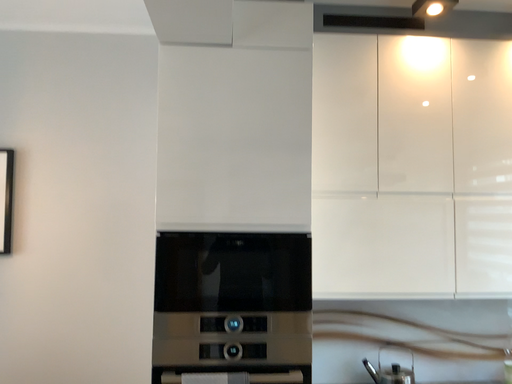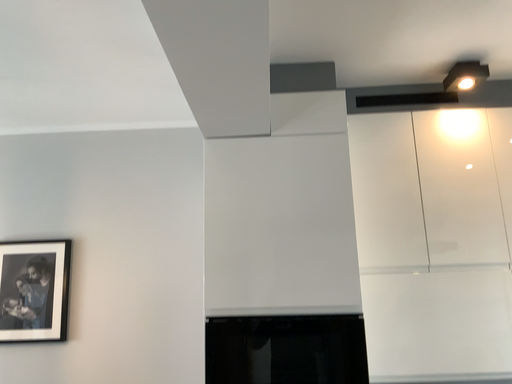
Question: Which way did the camera rotate in the video?

Choices:
 (A) rotated downward
 (B) rotated upward

Answer: (B)